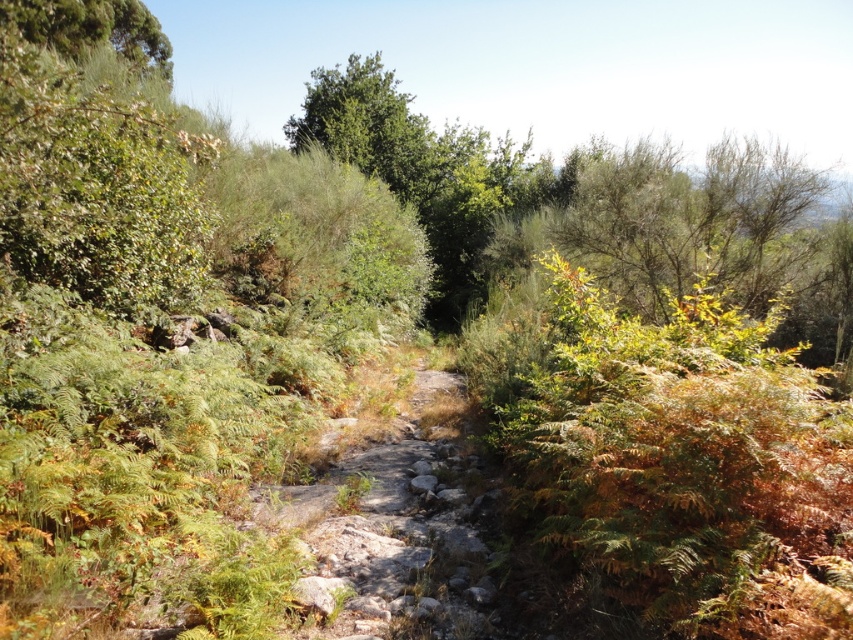
Question: Does gray rocky trail at center have a lesser width compared to green leafy bush at upper right?

Choices:
 (A) yes
 (B) no

Answer: (A)

Question: Does green leafy bush at upper right appear on the right side of green leafy tree at upper left?

Choices:
 (A) yes
 (B) no

Answer: (A)

Question: Which object is closer to the camera taking this photo?

Choices:
 (A) green leafy tree at upper left
 (B) gray rocky trail at center
 (C) green leafy bush at upper right

Answer: (B)

Question: Among these points, which one is nearest to the camera?

Choices:
 (A) (380, 499)
 (B) (21, 20)

Answer: (A)

Question: Which of the following is the farthest from the observer?

Choices:
 (A) gray rocky trail at center
 (B) green leafy bush at upper right

Answer: (B)

Question: Is green leafy bush at upper right above green leafy tree at upper left?

Choices:
 (A) yes
 (B) no

Answer: (B)